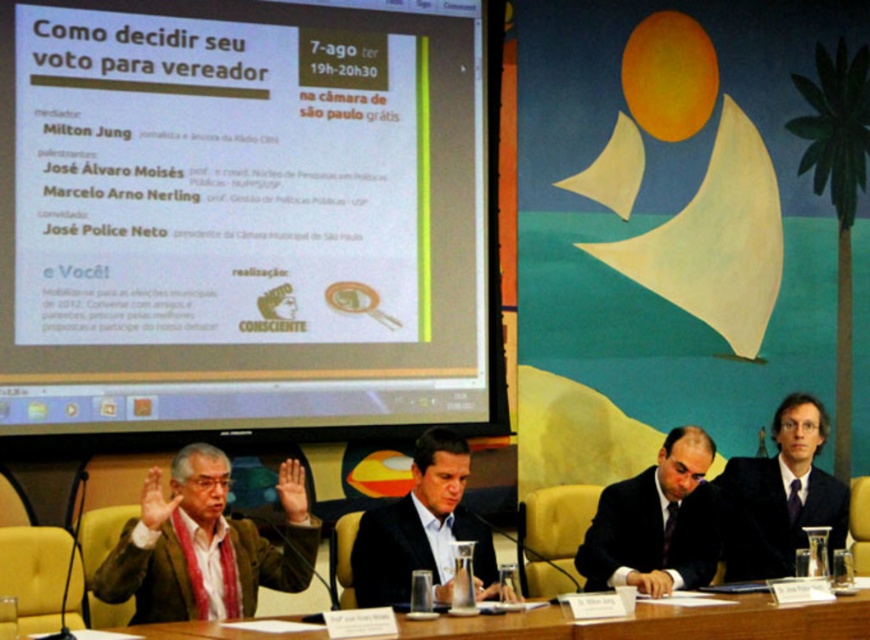
You are attending a virtual meeting and want to focus on the two points marked in the image. Which point, point (253,208) or point (674,557), is closer to you?

Point (253,208) is closer to you because it is further to the viewer than point (674,557).

You are an event organizer setting up a new projector for the upcoming panel discussion. The projector needs to be placed at point 0.336, 0.283 to project onto the white matte projector screen at upper left. Is this placement feasible given the current setup?

The white matte projector screen at upper left is already positioned at point (245, 214), so placing the projector at that exact coordinate would mean the projector is directly in front of the screen, which is feasible for projection as long as there are no obstructions between them.